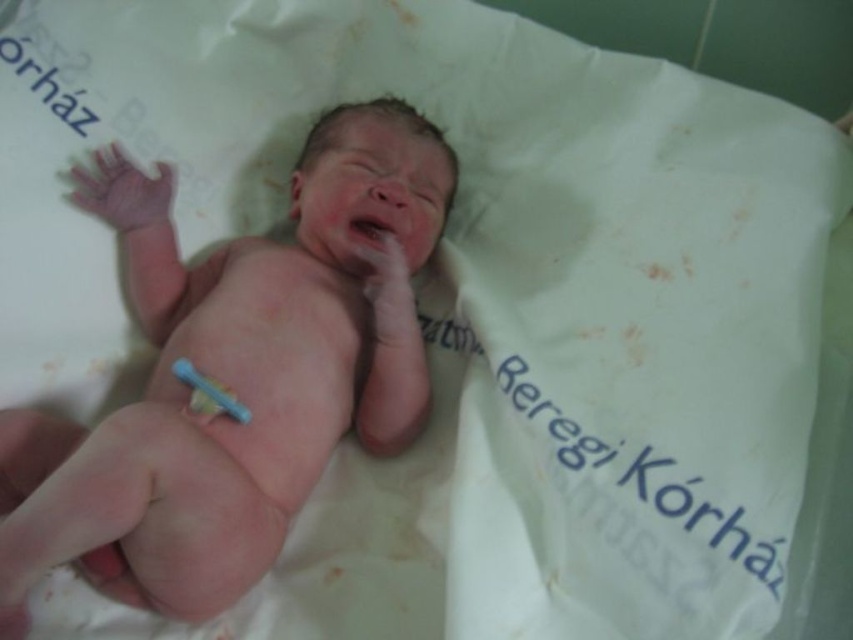
You are a healthcare professional examining the newborn. You notice the pink smooth flesh at center and the blue plastic toothbrush at lower center. Which object is closer to you?

The pink smooth flesh at center is closer to you than the blue plastic toothbrush at lower center because it is further to the viewer.

You are a nurse in a hospital nursery. You need to place the blue plastic toothbrush at lower center near the pink smooth flesh at center. Will the toothbrush be taller than the baby when placed there?

The pink smooth flesh at center has a lesser height compared to blue plastic toothbrush at lower center, so yes, the blue plastic toothbrush at lower center will be taller than the baby when placed near the pink smooth flesh at center.